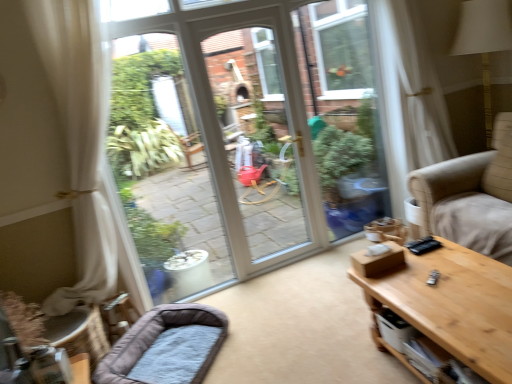
Question: Is wooden table at right bigger or smaller than gray plush dog bed at lower left?

Choices:
 (A) big
 (B) small

Answer: (A)

Question: Considering the positions of point (489, 324) and point (99, 364), is point (489, 324) closer or farther from the camera than point (99, 364)?

Choices:
 (A) closer
 (B) farther

Answer: (A)

Question: Is wooden table at right taller or shorter than gray plush dog bed at lower left?

Choices:
 (A) short
 (B) tall

Answer: (B)

Question: Looking at the image, does gray plush dog bed at lower left seem bigger or smaller compared to wooden table at right?

Choices:
 (A) small
 (B) big

Answer: (A)

Question: Considering the positions of gray plush dog bed at lower left and wooden table at right in the image, is gray plush dog bed at lower left taller or shorter than wooden table at right?

Choices:
 (A) tall
 (B) short

Answer: (B)

Question: Does point (121, 360) appear closer or farther from the camera than point (473, 332)?

Choices:
 (A) farther
 (B) closer

Answer: (A)

Question: From a real-world perspective, relative to wooden table at right, is gray plush dog bed at lower left vertically above or below?

Choices:
 (A) below
 (B) above

Answer: (A)